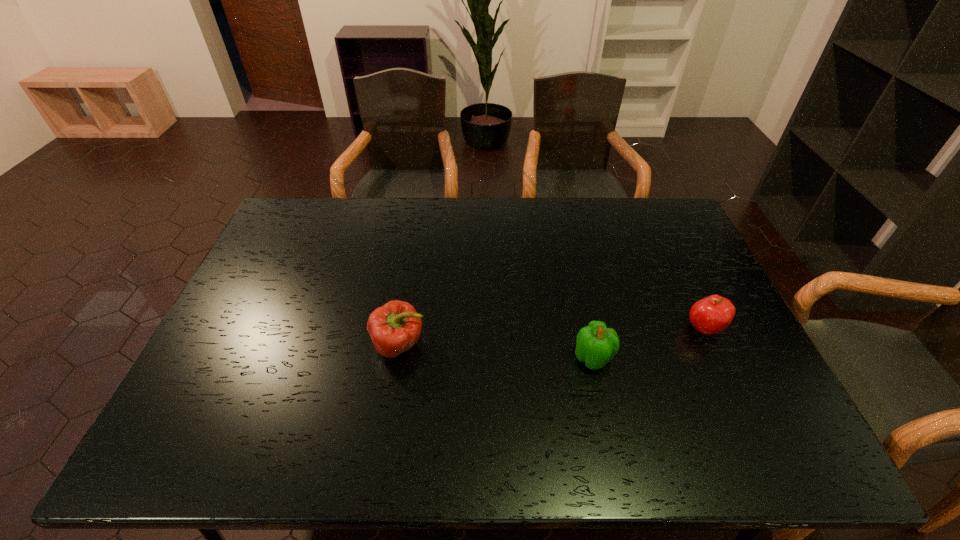
At what (x,y) coordinates should I click in order to perform the action: click on the leftmost object. Please return your answer as a coordinate pair (x, y). Image resolution: width=960 pixels, height=540 pixels. Looking at the image, I should click on (395, 327).

Locate an element on the screen. the shorter bell pepper is located at coordinates (596, 344).

The image size is (960, 540). What are the coordinates of `the right bell pepper` in the screenshot? It's located at (596, 344).

Where is `apple`? The height and width of the screenshot is (540, 960). apple is located at coordinates (713, 314).

Locate an element on the screen. Image resolution: width=960 pixels, height=540 pixels. free space located 0.080m on the right of the leftmost object is located at coordinates (457, 345).

Find the location of a particular element. blank space located 0.320m on the right of the shorter bell pepper is located at coordinates tap(735, 358).

Where is `vacant area located on the back of the apple`? The width and height of the screenshot is (960, 540). vacant area located on the back of the apple is located at coordinates (691, 303).

This screenshot has width=960, height=540. Find the location of `object at the right edge`. object at the right edge is located at coordinates (713, 314).

You are a GUI agent. You are given a task and a screenshot of the screen. Output one action in this format:
    pyautogui.click(x=<x>, y=<y>)
    Task: Click on the blank space at the far edge
    The width and height of the screenshot is (960, 540).
    Given the screenshot: What is the action you would take?
    pyautogui.click(x=324, y=237)

In order to click on vacant space at the near edge of the desktop in this screenshot , I will do coord(576,459).